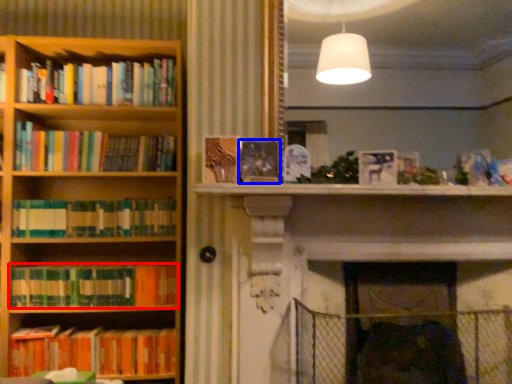
Question: Which of the following is the farthest to the observer, book (highlighted by a red box) or book (highlighted by a blue box)?

Choices:
 (A) book
 (B) book

Answer: (A)